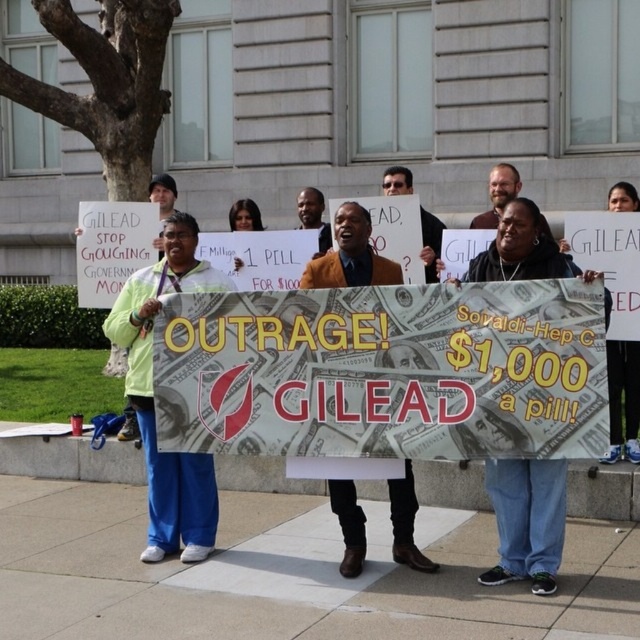
You are a photographer standing at the back of the protest scene. You want to take a photo of the matte brown shirt at center and the smooth brown skin at center without any obstruction. Given that your camera has a maximum focus range of 25 inches, can you capture both subjects clearly in the same shot?

The matte brown shirt at center is 26.51 inches away from smooth brown skin at center. Since the distance between them exceeds the camera maximum focus range of 25 inches, you cannot capture both subjects clearly in the same shot.

You are a photographer at the protest scene. You want to take a photo that includes both the banner with the text and the group holding it. The banner is at point [145,342] and the group is at point [506,195]. Which point should you focus on first to ensure both are in frame?

You should focus on point [145,342] first because it is in front of point [506,195], ensuring the banner and group are both visible in the photo.